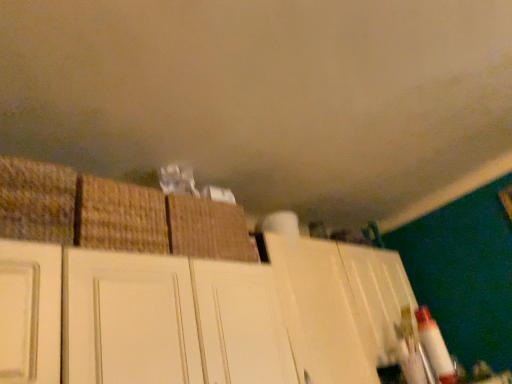
Question: From the image's perspective, relative to woven straw basket at left, which is the 1th basket from left to right, is white matte cabinet at upper center above or below?

Choices:
 (A) above
 (B) below

Answer: (B)

Question: Would you say white matte cabinet at upper center is to the left or to the right of woven straw basket at left, the third basket in the right-to-left sequence, in the picture?

Choices:
 (A) right
 (B) left

Answer: (A)

Question: Considering the real-world distances, which object is closest to the brown woven basket at center, the second basket in the left-to-right sequence?

Choices:
 (A) white matte cabinet at upper center
 (B) brown woven basket at center, positioned as the 3th basket in left-to-right order
 (C) woven straw basket at left, the third basket in the right-to-left sequence

Answer: (C)

Question: Estimate the real-world distances between objects in this image. Which object is closer to the white matte cabinet at upper center?

Choices:
 (A) brown woven basket at center, the 1th basket positioned from the right
 (B) brown woven basket at center, the second basket in the left-to-right sequence
 (C) woven straw basket at left, which is the 1th basket from left to right

Answer: (A)